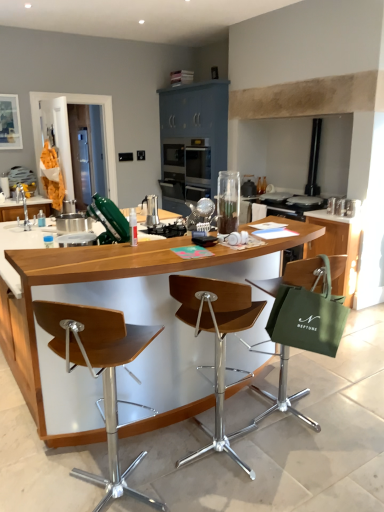
I want to click on vacant area to the right of wooden seat at center, marked as the 2th chair in a right-to-left arrangement, so [296, 472].